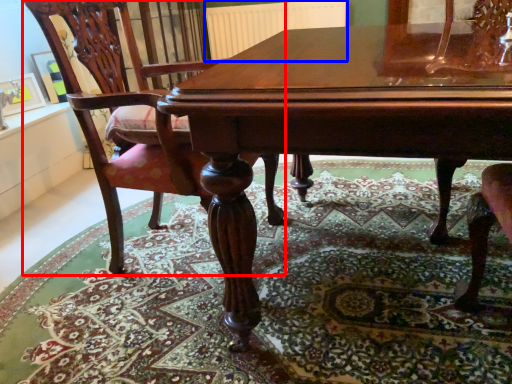
Question: Which object appears closest to the camera in this image, chair (highlighted by a red box) or radiator (highlighted by a blue box)?

Choices:
 (A) chair
 (B) radiator

Answer: (A)